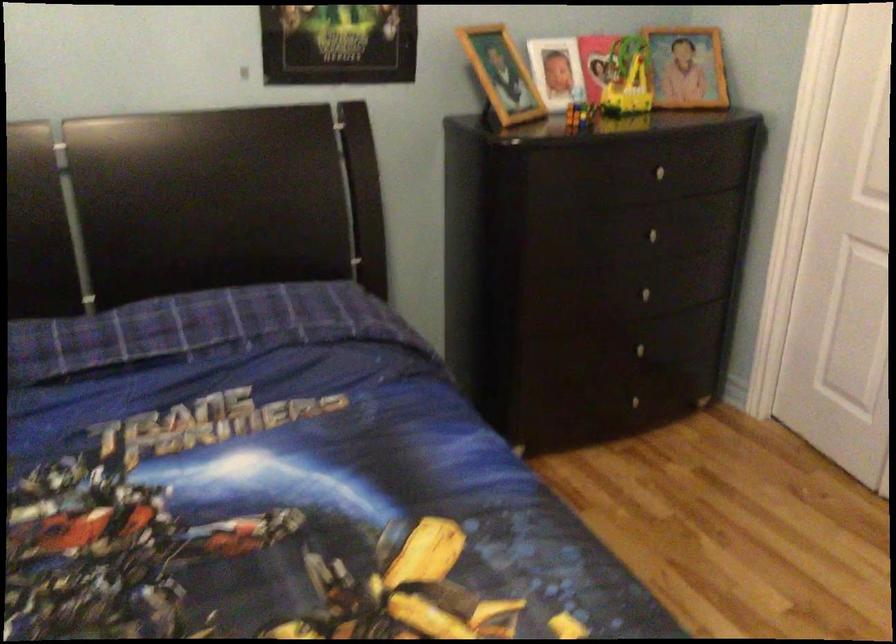
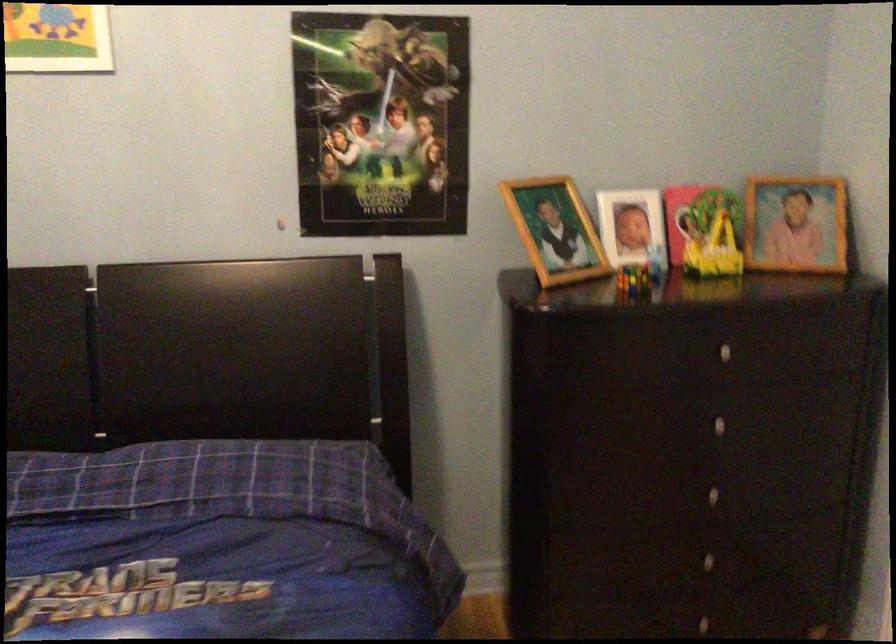
In the second image, find the point that corresponds to [501,75] in the first image.

(555, 230)